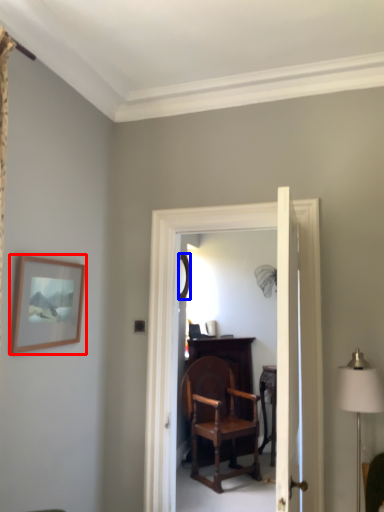
Question: Which of the following is the closest to the observer, picture frame (highlighted by a red box) or mirror (highlighted by a blue box)?

Choices:
 (A) picture frame
 (B) mirror

Answer: (A)